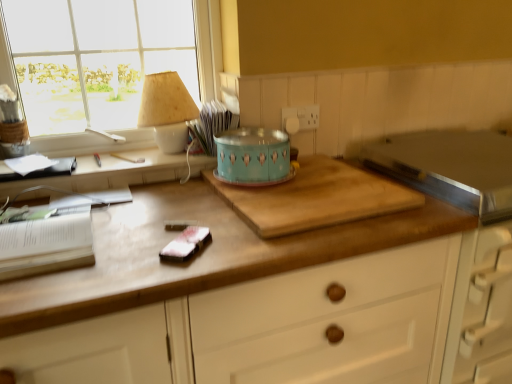
Find the location of a particular element. The height and width of the screenshot is (384, 512). vacant space in between white paper book at left and satin pink fabric at center is located at coordinates (123, 234).